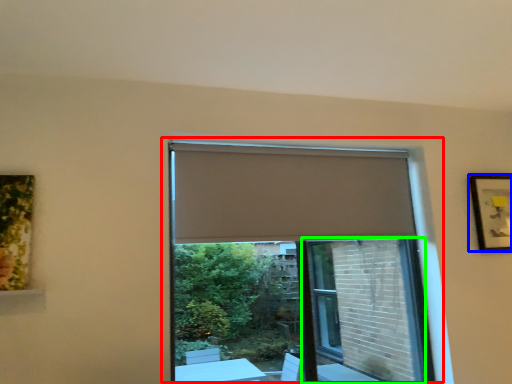
Question: Based on their relative distances, which object is nearer to window (highlighted by a red box)? Choose from picture frame (highlighted by a blue box) and screen door (highlighted by a green box).

Choices:
 (A) picture frame
 (B) screen door

Answer: (B)